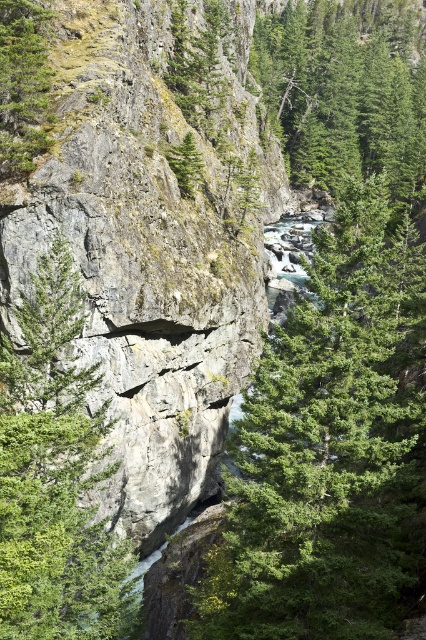
Based on the photo, is green leafy tree at center positioned in front of green rough rock at center?

No.

Does green leafy tree at center have a greater width compared to green rough rock at center?

Correct, the width of green leafy tree at center exceeds that of green rough rock at center.

Is point (350, 244) more distant than point (57, 636)?

Yes, it is behind point (57, 636).

This screenshot has width=426, height=640. Find the location of `green leafy tree at center`. green leafy tree at center is located at coordinates (331, 448).

Is point (42, 106) less distant than point (181, 150)?

Yes.

Does green matte tree at upper left have a larger size compared to green rough tree at center?

No, green matte tree at upper left is not bigger than green rough tree at center.

The height and width of the screenshot is (640, 426). I want to click on green matte tree at upper left, so click(23, 83).

Who is shorter, green leafy tree at center or green matte tree at upper left?

green matte tree at upper left

This screenshot has width=426, height=640. What are the coordinates of `green leafy tree at center` in the screenshot? It's located at (331, 448).